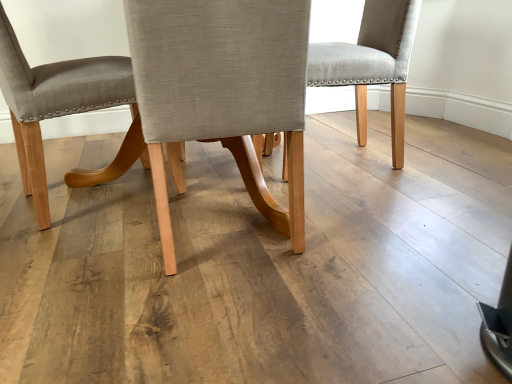
The height and width of the screenshot is (384, 512). I want to click on matte gray fabric chair at center, which appears as the first chair when viewed from the left, so click(x=54, y=100).

This screenshot has width=512, height=384. Identify the location of light gray fabric chair at center, the 1th chair when ordered from right to left. (372, 63).

Which of these two, matte gray fabric chair at center, placed as the third chair when sorted from right to left, or light gray fabric chair at center, which is the third chair in left-to-right order, stands shorter?

light gray fabric chair at center, which is the third chair in left-to-right order, is shorter.

In the scene shown: Is matte gray fabric chair at center, which appears as the first chair when viewed from the left, to the right of light gray fabric chair at center, which is the third chair in left-to-right order, from the viewer's perspective?

No, matte gray fabric chair at center, which appears as the first chair when viewed from the left, is not to the right of light gray fabric chair at center, which is the third chair in left-to-right order.

Does matte gray fabric chair at center, which appears as the first chair when viewed from the left, have a greater width compared to light gray fabric chair at center, which is the third chair in left-to-right order?

Yes, matte gray fabric chair at center, which appears as the first chair when viewed from the left, is wider than light gray fabric chair at center, which is the third chair in left-to-right order.

How many degrees apart are the facing directions of matte gray fabric chair at center, placed as the third chair when sorted from right to left, and light gray fabric chair at center, the 1th chair when ordered from right to left?

They differ by 161 degrees in their facing directions.

I want to click on chair behind the matte gray fabric chair at center, placed as the third chair when sorted from right to left, so click(x=372, y=63).

From a real-world perspective, is light gray fabric chair at center, the 1th chair when ordered from right to left, on matte gray fabric chair at center, placed as the third chair when sorted from right to left?

No.

Is light gray fabric chair at center, the 1th chair when ordered from right to left, aimed at matte gray fabric chair at center, placed as the third chair when sorted from right to left?

Yes, light gray fabric chair at center, the 1th chair when ordered from right to left, faces towards matte gray fabric chair at center, placed as the third chair when sorted from right to left.

Are light gray fabric chair at center, the 1th chair when ordered from right to left, and matte gray fabric chair at center, which appears as the first chair when viewed from the left, making contact?

No, light gray fabric chair at center, the 1th chair when ordered from right to left, is not making contact with matte gray fabric chair at center, which appears as the first chair when viewed from the left.

Could you tell me if matte gray fabric chair at center, placed as the third chair when sorted from right to left, is turned towards light gray fabric chair at center, marked as the 2th chair in a right-to-left arrangement?

No, matte gray fabric chair at center, placed as the third chair when sorted from right to left, is not turned towards light gray fabric chair at center, marked as the 2th chair in a right-to-left arrangement.

Which is closer to the camera, (131, 73) or (255, 95)?

Point (131, 73) is positioned farther from the camera compared to point (255, 95).

From a real-world perspective, who is located lower, matte gray fabric chair at center, which appears as the first chair when viewed from the left, or light gray fabric chair at center, marked as the 2th chair in a right-to-left arrangement?

light gray fabric chair at center, marked as the 2th chair in a right-to-left arrangement, from a real-world perspective.

From the image's perspective, which is above, matte gray fabric chair at center, placed as the third chair when sorted from right to left, or light gray fabric chair at center, which is counted as the second chair, starting from the left?

From the image's view, matte gray fabric chair at center, placed as the third chair when sorted from right to left, is above.

Which is closer, (407, 30) or (295, 86)?

Point (407, 30).

Choose the correct answer: Is light gray fabric chair at center, the 1th chair when ordered from right to left, inside light gray fabric chair at center, marked as the 2th chair in a right-to-left arrangement, or outside it?

light gray fabric chair at center, the 1th chair when ordered from right to left, is spatially situated outside light gray fabric chair at center, marked as the 2th chair in a right-to-left arrangement.

From the image's perspective, which is below, light gray fabric chair at center, which is the third chair in left-to-right order, or light gray fabric chair at center, marked as the 2th chair in a right-to-left arrangement?

light gray fabric chair at center, marked as the 2th chair in a right-to-left arrangement.

Based on the photo, which is closer to the camera, (161, 180) or (23, 133)?

Point (161, 180) appears to be closer to the viewer than point (23, 133).

Where is `chair lying below the matte gray fabric chair at center, placed as the third chair when sorted from right to left (from the image's perspective)`? The image size is (512, 384). chair lying below the matte gray fabric chair at center, placed as the third chair when sorted from right to left (from the image's perspective) is located at coordinates (223, 91).

Can you confirm if light gray fabric chair at center, marked as the 2th chair in a right-to-left arrangement, is smaller than matte gray fabric chair at center, placed as the third chair when sorted from right to left?

Correct, light gray fabric chair at center, marked as the 2th chair in a right-to-left arrangement, occupies less space than matte gray fabric chair at center, placed as the third chair when sorted from right to left.

From a real-world perspective, is light gray fabric chair at center, which is counted as the second chair, starting from the left, positioned under matte gray fabric chair at center, which appears as the first chair when viewed from the left, based on gravity?

Correct, in the physical world, light gray fabric chair at center, which is counted as the second chair, starting from the left, is lower than matte gray fabric chair at center, which appears as the first chair when viewed from the left.

From the image's perspective, is light gray fabric chair at center, which is counted as the second chair, starting from the left, positioned above or below light gray fabric chair at center, which is the third chair in left-to-right order?

light gray fabric chair at center, which is counted as the second chair, starting from the left, is situated lower than light gray fabric chair at center, which is the third chair in left-to-right order, in the image.

Between light gray fabric chair at center, which is counted as the second chair, starting from the left, and light gray fabric chair at center, the 1th chair when ordered from right to left, which one is positioned behind?

light gray fabric chair at center, the 1th chair when ordered from right to left.

From a real-world perspective, who is located higher, light gray fabric chair at center, marked as the 2th chair in a right-to-left arrangement, or light gray fabric chair at center, which is the third chair in left-to-right order?

light gray fabric chair at center, marked as the 2th chair in a right-to-left arrangement, is physically above.

In the scene shown: Which of these two, light gray fabric chair at center, which is counted as the second chair, starting from the left, or light gray fabric chair at center, the 1th chair when ordered from right to left, is thinner?

light gray fabric chair at center, the 1th chair when ordered from right to left.

At what (x,y) coordinates should I click in order to perform the action: click on the 2nd chair to the right of the matte gray fabric chair at center, which appears as the first chair when viewed from the left, starting your count from the anchor. Please return your answer as a coordinate pair (x, y). This screenshot has height=384, width=512. Looking at the image, I should click on (x=372, y=63).

This screenshot has width=512, height=384. Identify the location of chair behind the matte gray fabric chair at center, which appears as the first chair when viewed from the left. (372, 63).

Considering their positions, is matte gray fabric chair at center, placed as the third chair when sorted from right to left, positioned further to light gray fabric chair at center, the 1th chair when ordered from right to left, than light gray fabric chair at center, marked as the 2th chair in a right-to-left arrangement?

Based on the image, matte gray fabric chair at center, placed as the third chair when sorted from right to left, appears to be further to light gray fabric chair at center, the 1th chair when ordered from right to left.

Estimate the real-world distances between objects in this image. Which object is closer to light gray fabric chair at center, marked as the 2th chair in a right-to-left arrangement, light gray fabric chair at center, the 1th chair when ordered from right to left, or matte gray fabric chair at center, placed as the third chair when sorted from right to left?

Among the two, matte gray fabric chair at center, placed as the third chair when sorted from right to left, is located nearer to light gray fabric chair at center, marked as the 2th chair in a right-to-left arrangement.

Estimate the real-world distances between objects in this image. Which object is closer to light gray fabric chair at center, which is the third chair in left-to-right order, light gray fabric chair at center, which is counted as the second chair, starting from the left, or matte gray fabric chair at center, placed as the third chair when sorted from right to left?

light gray fabric chair at center, which is counted as the second chair, starting from the left, lies closer to light gray fabric chair at center, which is the third chair in left-to-right order, than the other object.

From the image, which object appears to be nearer to matte gray fabric chair at center, placed as the third chair when sorted from right to left, light gray fabric chair at center, which is the third chair in left-to-right order, or light gray fabric chair at center, marked as the 2th chair in a right-to-left arrangement?

light gray fabric chair at center, marked as the 2th chair in a right-to-left arrangement.

Estimate the real-world distances between objects in this image. Which object is closer to light gray fabric chair at center, which is counted as the second chair, starting from the left, matte gray fabric chair at center, placed as the third chair when sorted from right to left, or light gray fabric chair at center, the 1th chair when ordered from right to left?

matte gray fabric chair at center, placed as the third chair when sorted from right to left, is closer to light gray fabric chair at center, which is counted as the second chair, starting from the left.

Considering their positions, is light gray fabric chair at center, marked as the 2th chair in a right-to-left arrangement, positioned closer to matte gray fabric chair at center, placed as the third chair when sorted from right to left, than light gray fabric chair at center, the 1th chair when ordered from right to left?

The object closer to matte gray fabric chair at center, placed as the third chair when sorted from right to left, is light gray fabric chair at center, marked as the 2th chair in a right-to-left arrangement.

You are a GUI agent. You are given a task and a screenshot of the screen. Output one action in this format:
    pyautogui.click(x=<x>, y=<y>)
    Task: Click on the chair between matte gray fabric chair at center, which appears as the first chair when viewed from the left, and light gray fabric chair at center, the 1th chair when ordered from right to left
    The height and width of the screenshot is (384, 512).
    Given the screenshot: What is the action you would take?
    pyautogui.click(x=223, y=91)